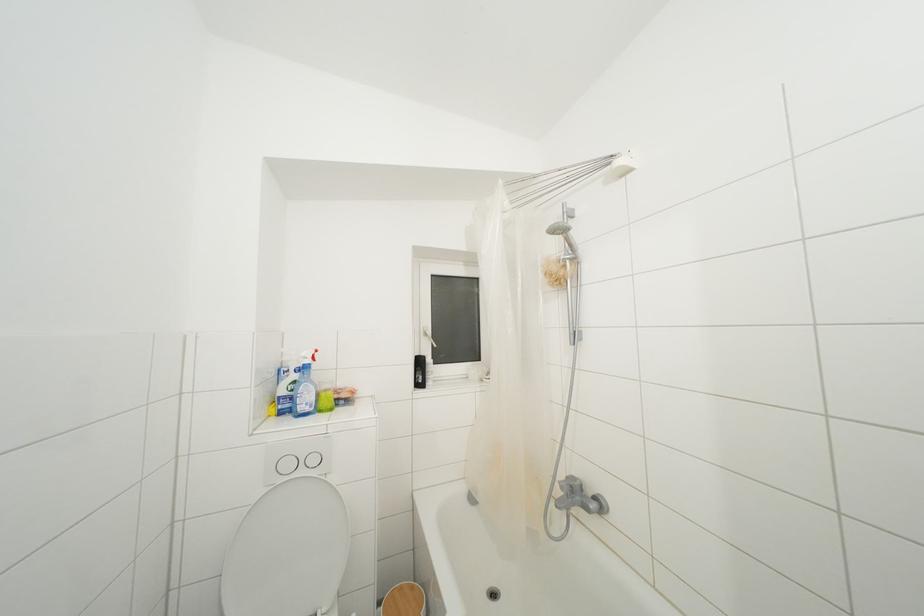
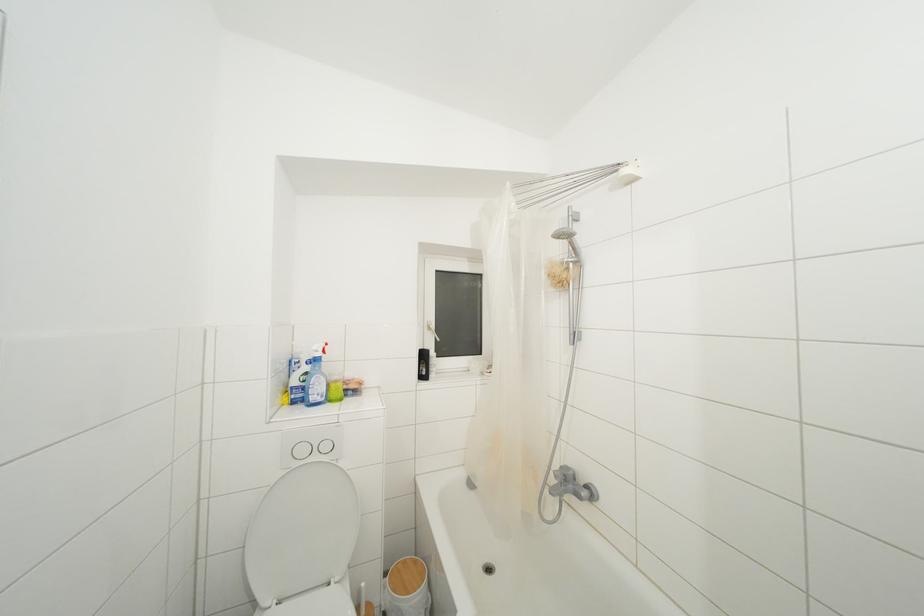
Find the pixel in the second image that matches point (423, 367) in the first image.

(428, 361)